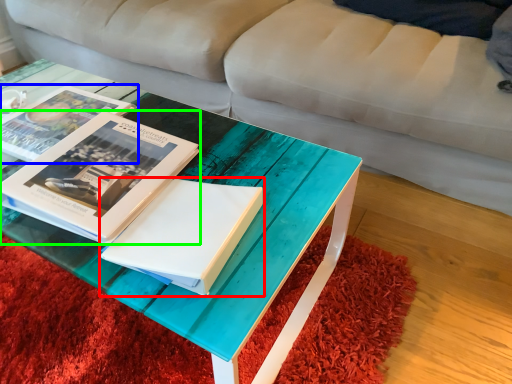
Question: Which object is the farthest from paperback book (highlighted by a red box)? Choose among these: book (highlighted by a blue box) or book (highlighted by a green box).

Choices:
 (A) book
 (B) book

Answer: (A)